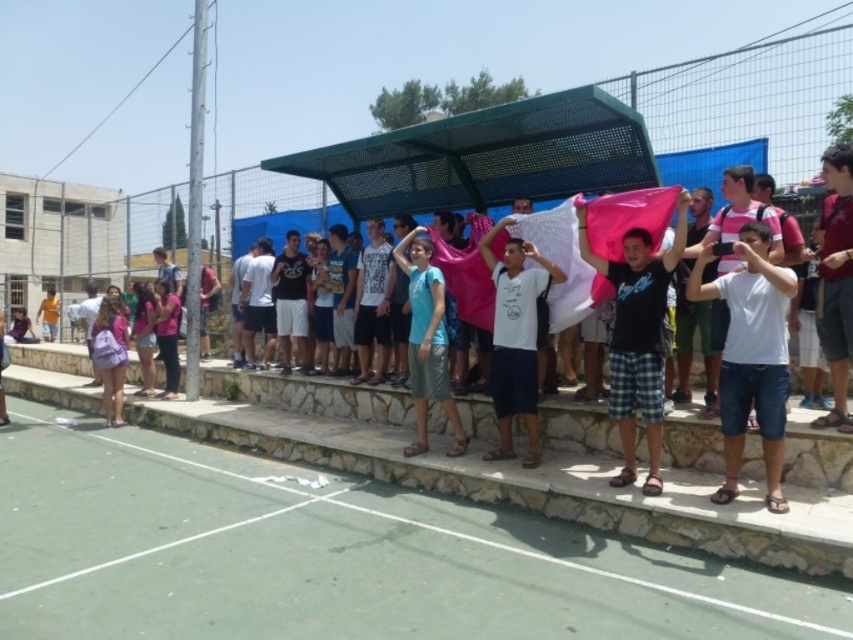
You are standing at the center of the image and want to walk to the green rubber court at lower center. Which direction should you move in to reach it?

To reach the green rubber court at lower center, you should move downward since it is located at point (329, 556), which is towards the lower part of the image.

You are a photographer trying to capture a photo of the white cotton shirt at center and the green rubber court at lower center. Which object is shorter in height?

The green rubber court at lower center is shorter than the white cotton shirt at center.